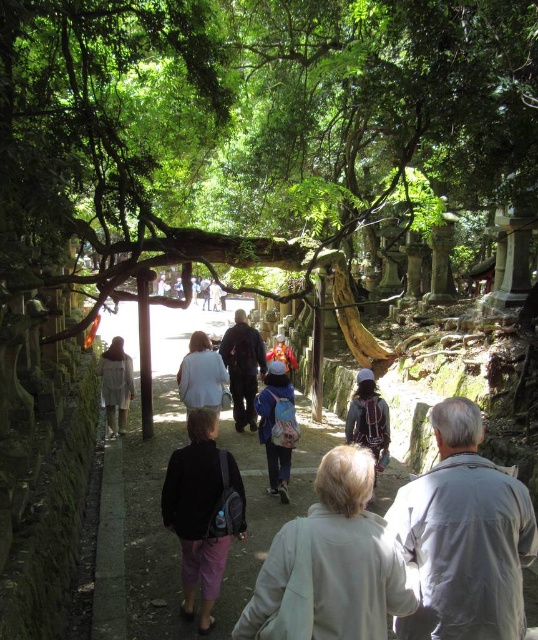
Can you confirm if pastel blue backpack at center is wider than matte black backpack at center?

Indeed, pastel blue backpack at center has a greater width compared to matte black backpack at center.

Is point (286, 406) closer to camera compared to point (359, 419)?

No, (286, 406) is behind (359, 419).

Who is more forward, (273, 429) or (353, 436)?

Positioned in front is point (273, 429).

What are the coordinates of `pastel blue backpack at center` in the screenshot? It's located at (277, 426).

Does dark brown leather jacket at center have a lesser height compared to light beige fabric dress at center?

No, dark brown leather jacket at center is not shorter than light beige fabric dress at center.

This screenshot has width=538, height=640. Find the location of `dark brown leather jacket at center`. dark brown leather jacket at center is located at coordinates (243, 368).

Find the location of a particular element. dark brown leather jacket at center is located at coordinates (243, 368).

Is pastel blue backpack at center taller than dark brown leather jacket at center?

No, pastel blue backpack at center is not taller than dark brown leather jacket at center.

Which is behind, point (265, 422) or point (235, 410)?

The point (235, 410) is more distant.

Locate an element on the screen. This screenshot has width=538, height=640. pastel blue backpack at center is located at coordinates (277, 426).